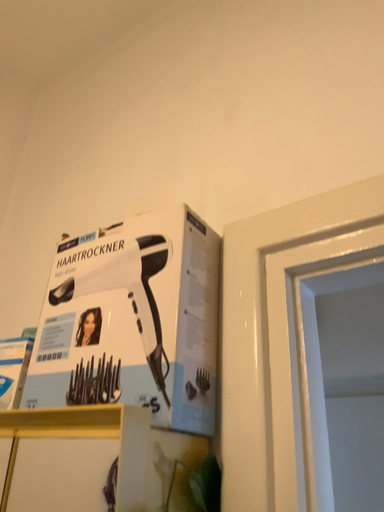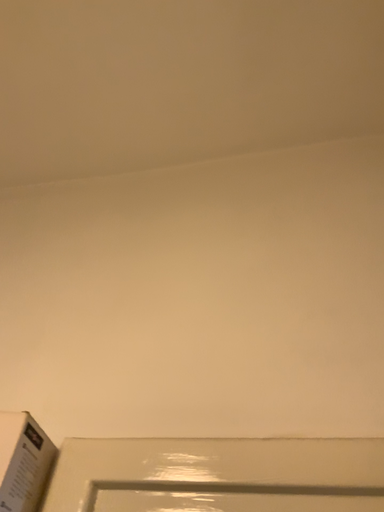
Question: How did the camera likely rotate when shooting the video?

Choices:
 (A) rotated right
 (B) rotated left

Answer: (A)